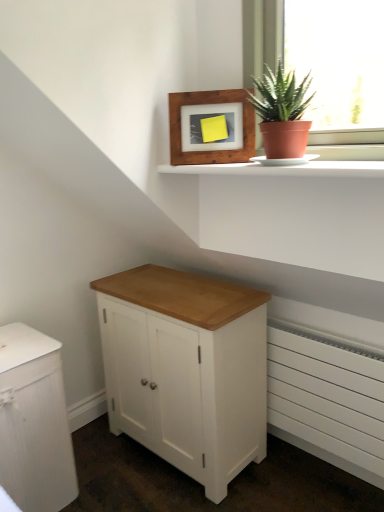
Where is `vacant space that is to the left of white matte radiator at lower right`? vacant space that is to the left of white matte radiator at lower right is located at coordinates (264, 484).